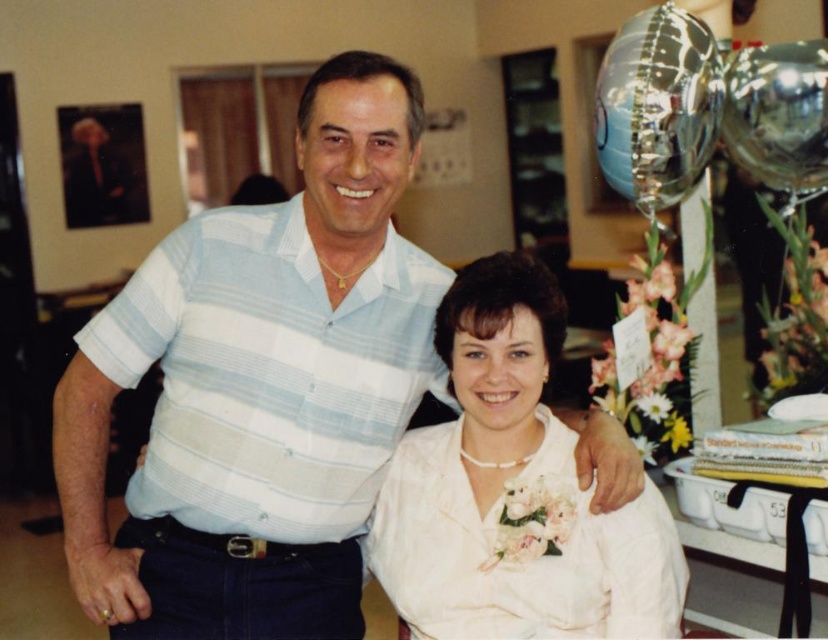
Question: Which point appears closest to the camera in this image?

Choices:
 (A) (668, 573)
 (B) (99, 484)

Answer: (A)

Question: Is light blue striped shirt at center to the left of white satin blouse at center from the viewer's perspective?

Choices:
 (A) no
 (B) yes

Answer: (B)

Question: Among these points, which one is farthest from the camera?

Choices:
 (A) (598, 477)
 (B) (468, 433)

Answer: (B)

Question: Where is light blue striped shirt at center located in relation to white satin blouse at center in the image?

Choices:
 (A) above
 (B) below

Answer: (A)

Question: Where is light blue striped shirt at center located in relation to white satin blouse at center in the image?

Choices:
 (A) above
 (B) below

Answer: (A)